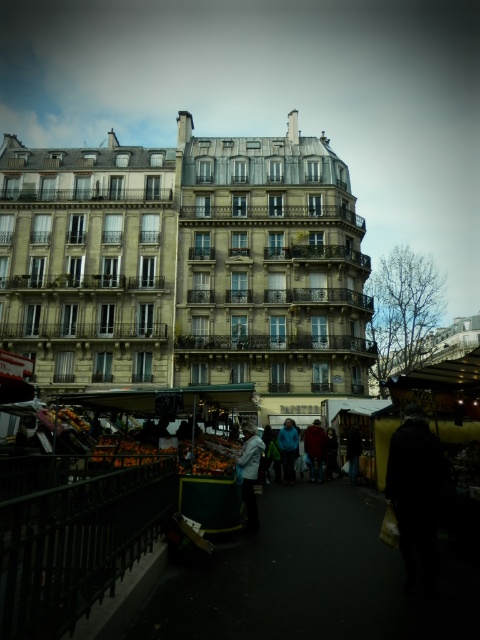
You are standing in the middle of the bustling street scene in front of the traditional European buildings. There is a point marked at coordinates (310, 458) in the image. If you want to reach that point quickly, would you need to walk towards the market stalls or away from them?

The point at (310, 458) is 66.49 meters away from the camera. Since the market stalls are in the foreground, which is closer to the camera, you would need to walk away from the market stalls to reach the point at (310, 458).

You are standing at the origin point of the image coordinate system. You want to find the dark blue jacket at center. In which direction should you move to locate it?

The dark blue jacket at center is located at coordinate point (314, 449). Since the origin is at the bottom left corner of the image, you should move to the right and upwards to reach it.

You are a pedestrian standing at the edge of the market stalls. You see a black matte coat at lower right and a dark blue jacket at center. Which clothing item is positioned higher from the ground?

The black matte coat at lower right is above the dark blue jacket at center, so it is positioned higher from the ground.